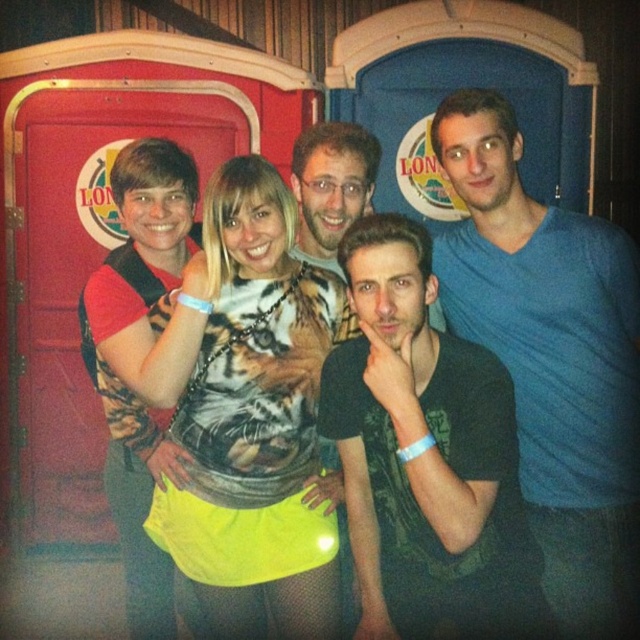
Question: Observing the image, what is the correct spatial positioning of blue cotton shirt at center in reference to tiger print shirt at center?

Choices:
 (A) right
 (B) left

Answer: (A)

Question: Is black matte t-shirt at center to the left of tiger print shirt at center from the viewer's perspective?

Choices:
 (A) yes
 (B) no

Answer: (B)

Question: Which object is the closest to the black matte t-shirt at center?

Choices:
 (A) blue cotton shirt at center
 (B) tiger print shirt at center

Answer: (B)

Question: Among these points, which one is nearest to the camera?

Choices:
 (A) (401, 388)
 (B) (260, 189)
 (C) (618, 525)

Answer: (A)

Question: Can you confirm if black matte t-shirt at center is bigger than tiger print shirt at center?

Choices:
 (A) no
 (B) yes

Answer: (B)

Question: Which is farther from the blue cotton shirt at center?

Choices:
 (A) black matte t-shirt at center
 (B) tiger print shirt at center

Answer: (B)